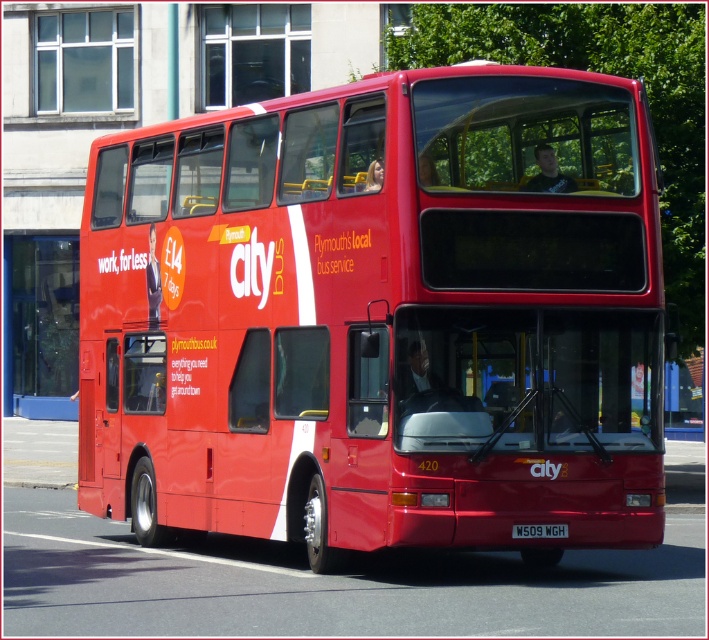
Consider the image. You are standing at the front of the Plymouth City Bus and looking towards the back. There are two points marked on the bus, point at position (347, 412) and point at position (537, 525). Which point is closer to you?

Point at position (347, 412) is closer to you because it is further to the viewer than point at position (537, 525).

Looking at this image, you are a photographer trying to capture the Plymouth City Bus advertisement. You notice the shiny red bus at center and the black plastic license plate at center. Which object would appear narrower in your photo?

The shiny red bus at center is thinner than the black plastic license plate at center, so it would appear narrower in the photo.